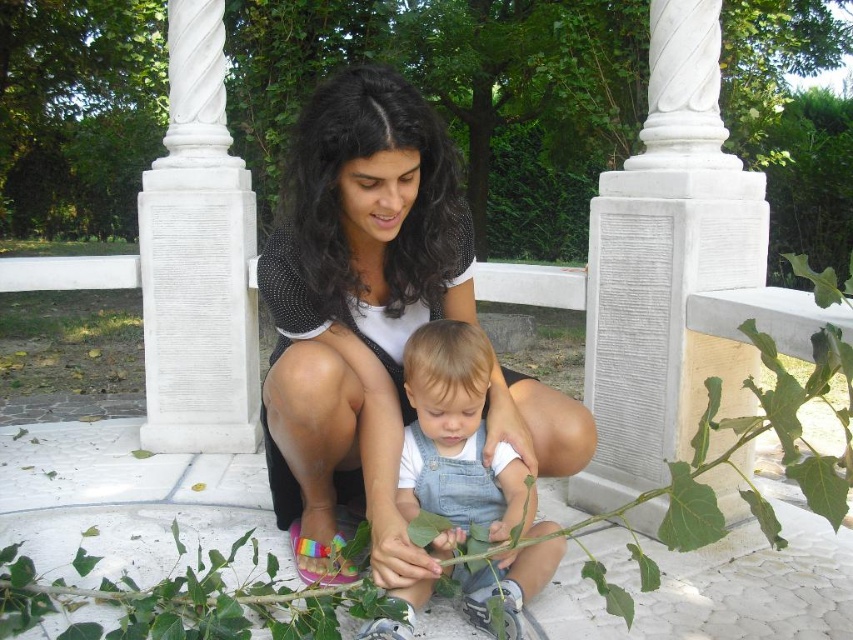
Question: Which object is farther from the camera taking this photo?

Choices:
 (A) denim overalls at center
 (B) black mesh top at center

Answer: (B)

Question: Which object is farther from the camera taking this photo?

Choices:
 (A) black mesh top at center
 (B) denim overalls at center

Answer: (A)

Question: Is black mesh top at center positioned at the back of denim overalls at center?

Choices:
 (A) yes
 (B) no

Answer: (A)

Question: Can you confirm if black mesh top at center is thinner than denim overalls at center?

Choices:
 (A) no
 (B) yes

Answer: (A)

Question: Where is black mesh top at center located in relation to denim overalls at center in the image?

Choices:
 (A) left
 (B) right

Answer: (A)

Question: Which of the following is the closest to the observer?

Choices:
 (A) (341, 342)
 (B) (477, 596)

Answer: (B)